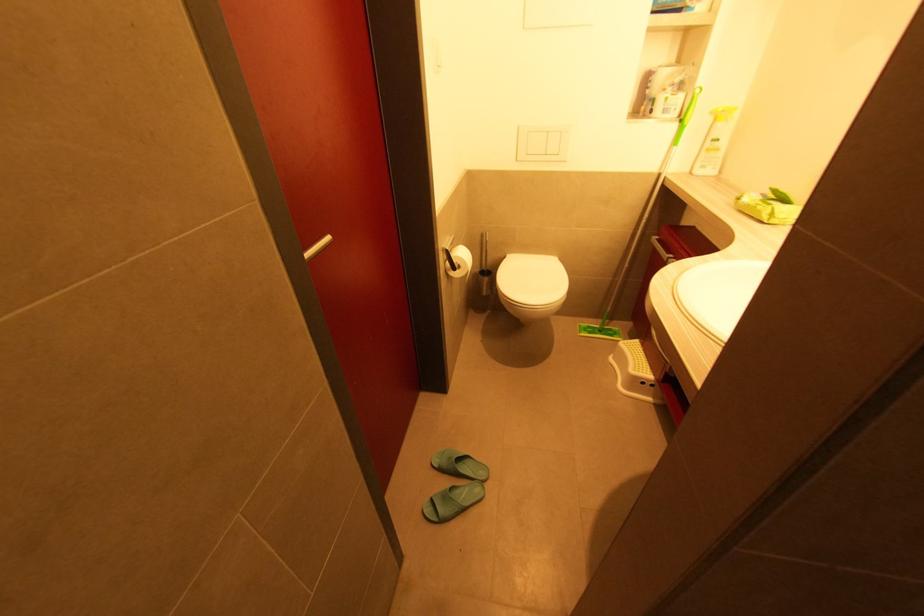
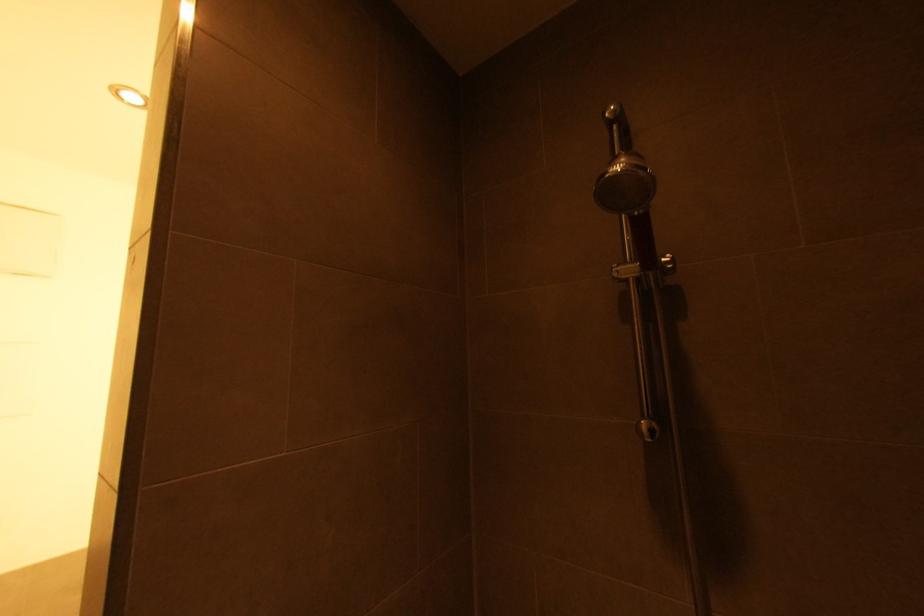
First-person continuous shooting, in which direction is the camera rotating?

The camera rotated toward right-up.